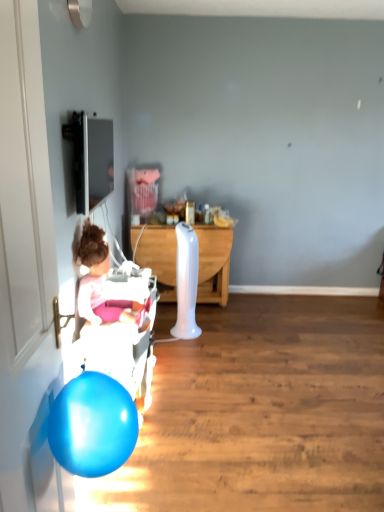
Locate an element on the screen. vacant area that lies in front of white plastic baby carriage at left is located at coordinates (172, 462).